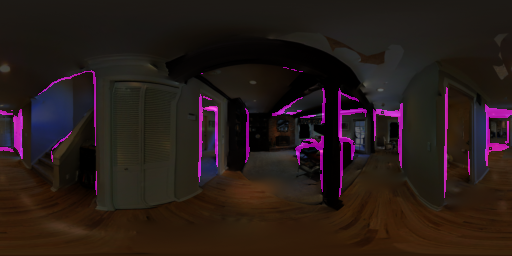
Where is `picture`? This screenshot has height=256, width=512. picture is located at coordinates (282, 125).